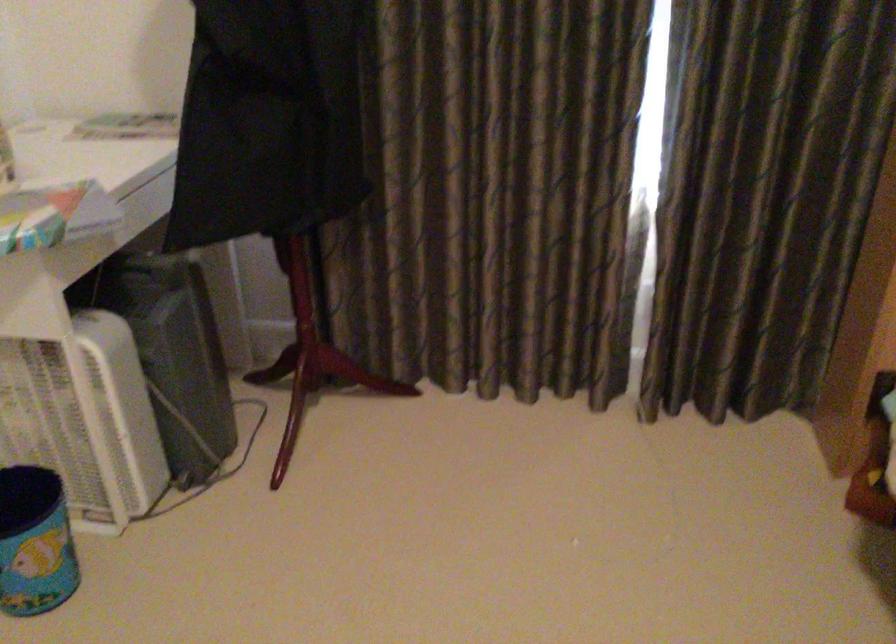
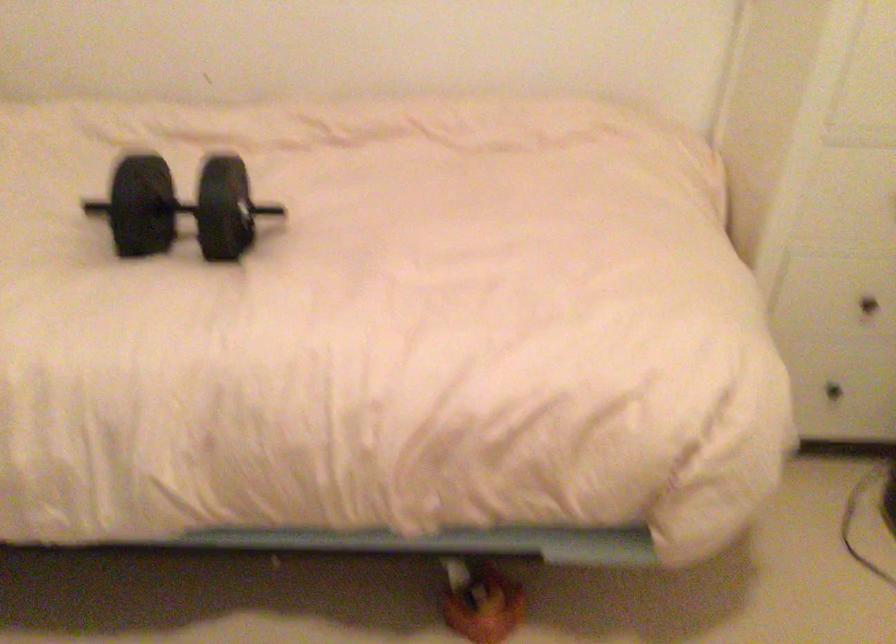
The images are taken continuously from a first-person perspective. In which direction is your viewpoint rotating?

The rotation direction of the camera is right-down.